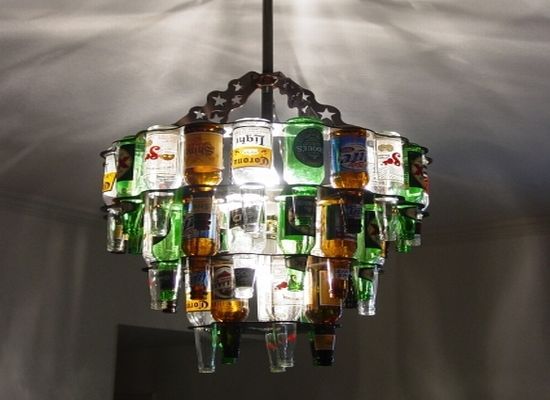
The height and width of the screenshot is (400, 550). What are the coordinates of `walls` in the screenshot? It's located at (477, 322), (74, 282).